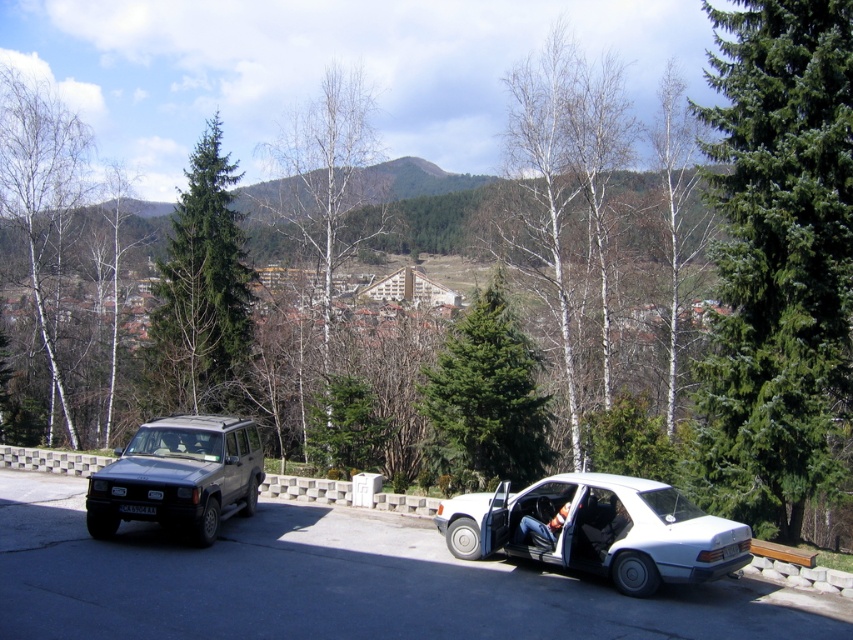
Is white matte sedan at center further to camera compared to metallic gray suv at left?

No, it is not.

Does white matte sedan at center lie in front of metallic gray suv at left?

Yes, white matte sedan at center is closer to the viewer.

At what (x,y) coordinates should I click in order to perform the action: click on white matte sedan at center. Please return your answer as a coordinate pair (x, y). This screenshot has height=640, width=853. Looking at the image, I should click on (599, 529).